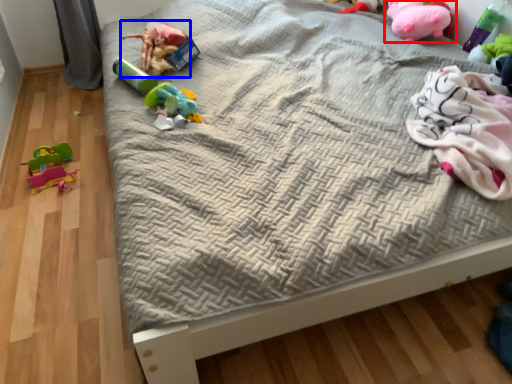
Question: Which point is further to the camera, toy (highlighted by a red box) or toy (highlighted by a blue box)?

Choices:
 (A) toy
 (B) toy

Answer: (A)